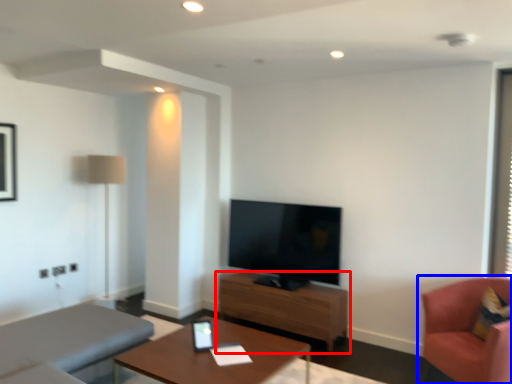
Question: Which point is further to the camera, table (highlighted by a red box) or chair (highlighted by a blue box)?

Choices:
 (A) table
 (B) chair

Answer: (A)